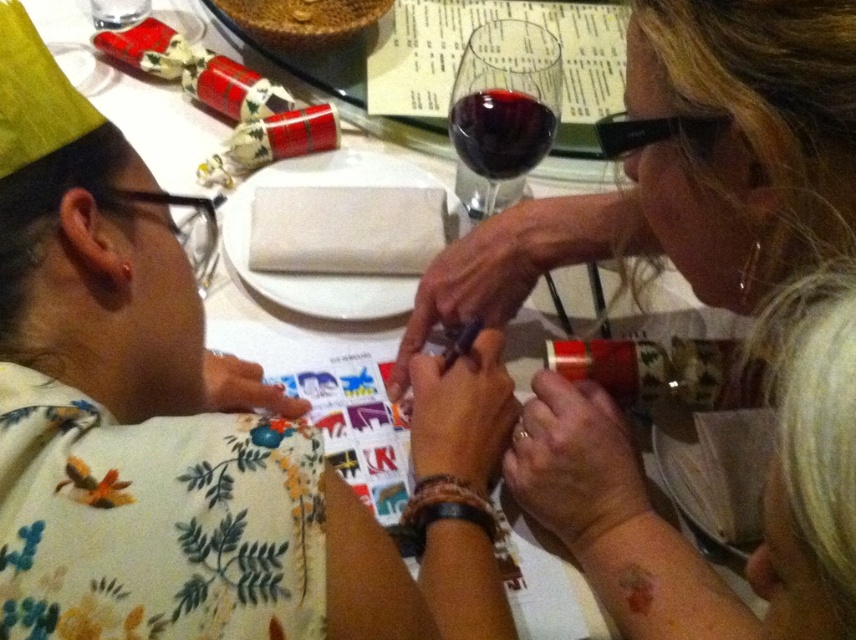
Does floral fabric shirt at center lie behind dark red glass at upper center?

No, it is in front of dark red glass at upper center.

Image resolution: width=856 pixels, height=640 pixels. I want to click on floral fabric shirt at center, so click(703, 301).

Is the position of transparent glass at center more distant than that of black plastic goggles at left?

That is True.

Does transparent glass at center appear over black plastic goggles at left?

Correct, transparent glass at center is located above black plastic goggles at left.

You are a GUI agent. You are given a task and a screenshot of the screen. Output one action in this format:
    pyautogui.click(x=<x>, y=<y>)
    Task: Click on the transparent glass at center
    The image size is (856, 640).
    Given the screenshot: What is the action you would take?
    pyautogui.click(x=504, y=100)

Does transparent glass at center have a larger size compared to black plastic glasses at upper right?

Indeed, transparent glass at center has a larger size compared to black plastic glasses at upper right.

Based on the photo, which is more to the left, transparent glass at center or black plastic glasses at upper right?

Positioned to the left is transparent glass at center.

At what (x,y) coordinates should I click in order to perform the action: click on transparent glass at center. Please return your answer as a coordinate pair (x, y). This screenshot has height=640, width=856. Looking at the image, I should click on (504, 100).